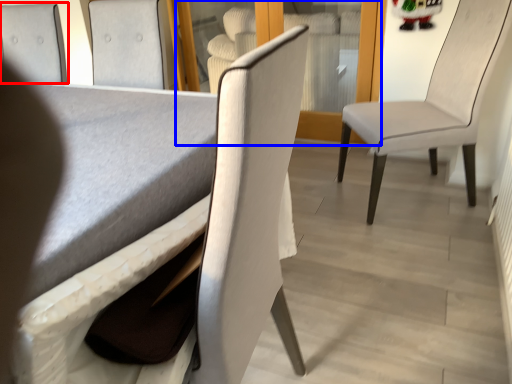
Question: Which object is closer to the camera taking this photo, chair (highlighted by a red box) or glass door (highlighted by a blue box)?

Choices:
 (A) chair
 (B) glass door

Answer: (A)